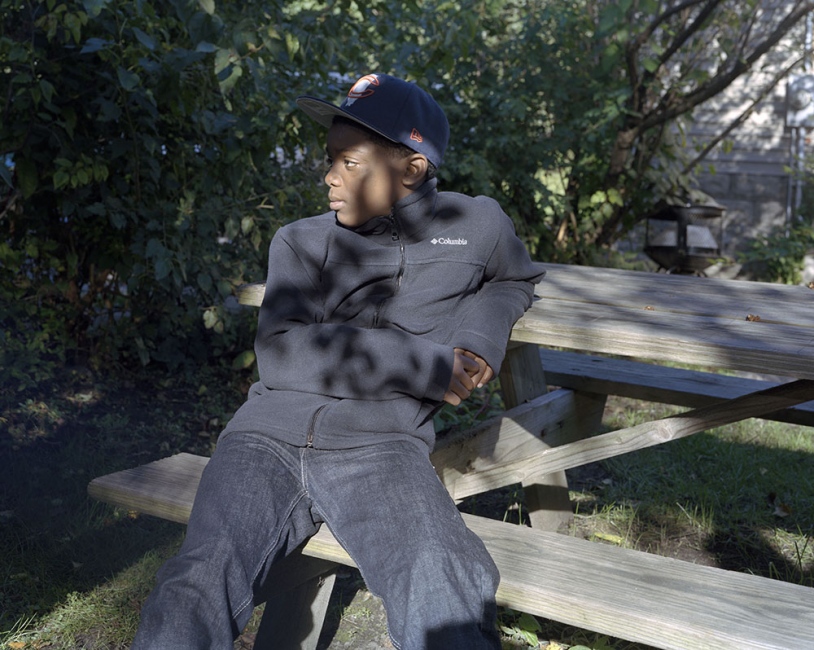
You are a GUI agent. You are given a task and a screenshot of the screen. Output one action in this format:
    pyautogui.click(x=<x>, y=<y>)
    Task: Click on the seat
    The image size is (814, 650).
    Given the screenshot: What is the action you would take?
    pyautogui.click(x=632, y=588)